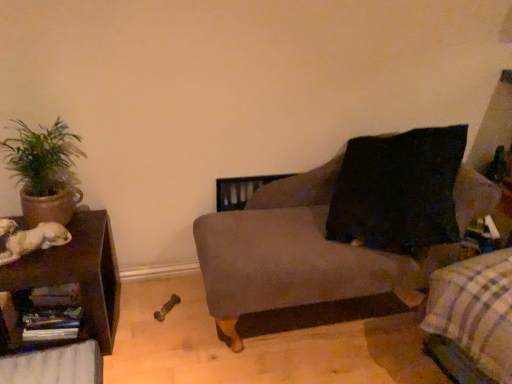
Question: Is point (13, 342) positioned closer to the camera than point (326, 165)?

Choices:
 (A) closer
 (B) farther

Answer: (A)

Question: From a real-world perspective, is wooden shelf at lower left above or below velvet gray couch at center?

Choices:
 (A) below
 (B) above

Answer: (A)

Question: Based on their relative distances, which object is nearer to the brown wood table at left?

Choices:
 (A) green leafy plant in clay pot at left
 (B) plaid fabric at lower right
 (C) white fur dog at left
 (D) wooden shelf at lower left
 (E) velvet gray couch at center

Answer: (D)

Question: Which is farther from the brown wood table at left?

Choices:
 (A) velvet gray couch at center
 (B) white fur dog at left
 (C) plaid fabric at lower right
 (D) green leafy plant in clay pot at left
 (E) wooden shelf at lower left

Answer: (C)